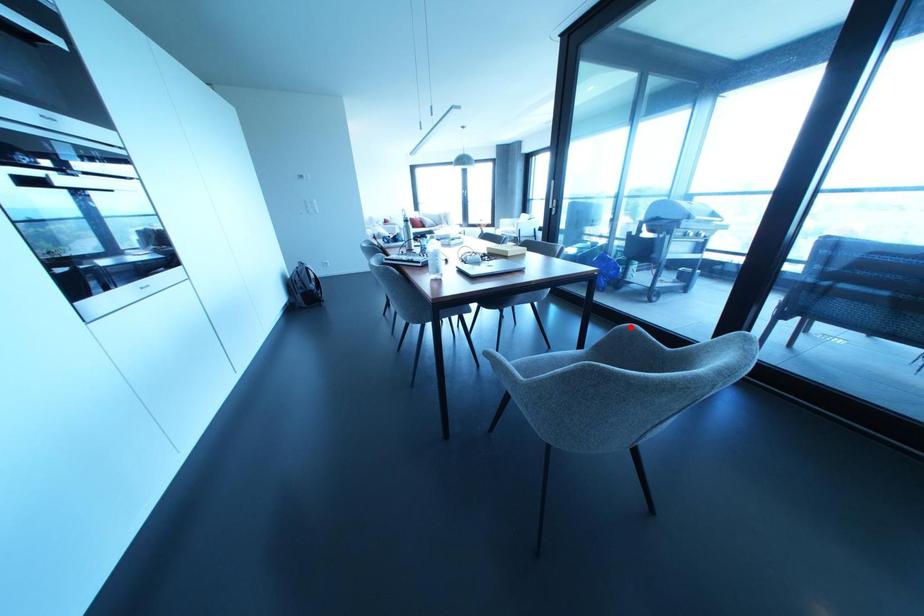
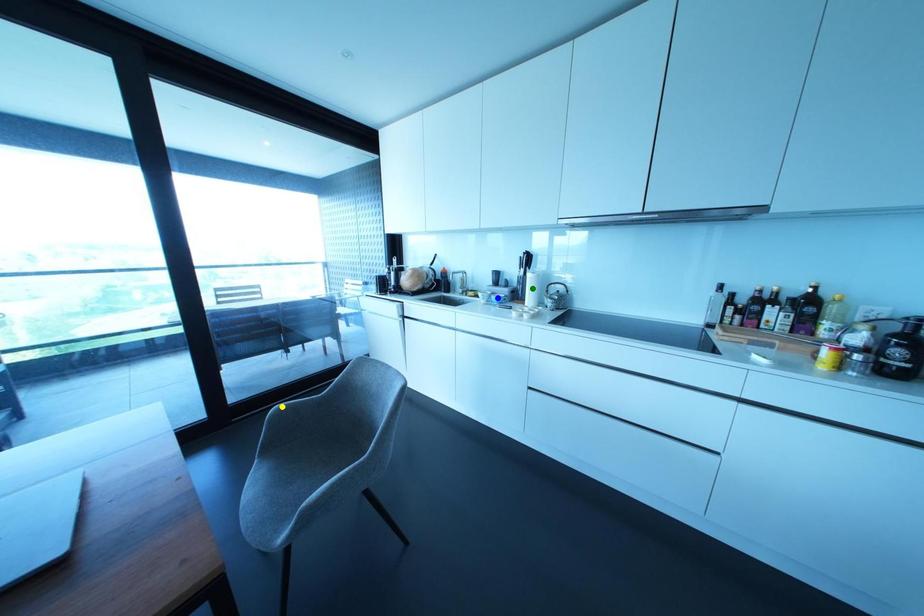
Question: I am providing you with two images of the same scene from different viewpoints. A red point is marked on the first image. You are given multiple points on the second image. Which point in image 2 represents the same 3d spot as the red point in image 1?

Choices:
 (A) yellow point
 (B) blue point
 (C) green point

Answer: (A)